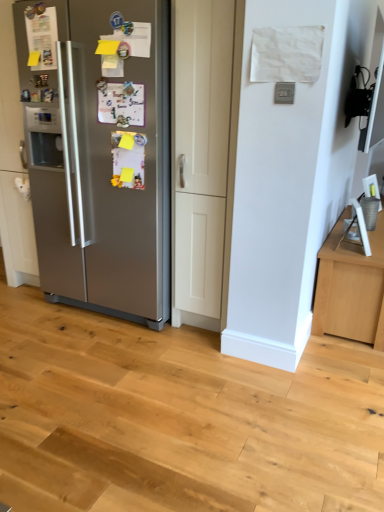
Describe the element at coordinates (99, 152) in the screenshot. Image resolution: width=384 pixels, height=512 pixels. I see `satin silver fridge at left` at that location.

The width and height of the screenshot is (384, 512). In order to click on satin silver fridge at left in this screenshot , I will do `click(99, 152)`.

The width and height of the screenshot is (384, 512). I want to click on satin silver fridge at left, so click(99, 152).